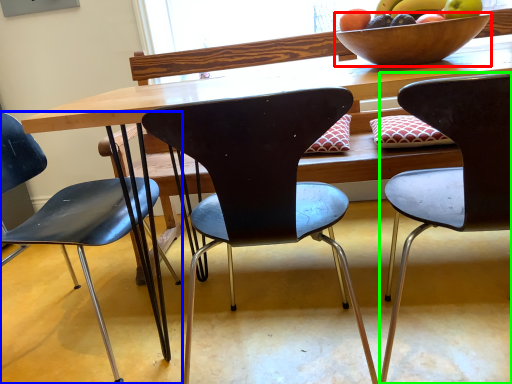
Question: Which object is positioned closest to bowl (highlighted by a red box)? Select from chair (highlighted by a blue box) and chair (highlighted by a green box).

Choices:
 (A) chair
 (B) chair

Answer: (B)